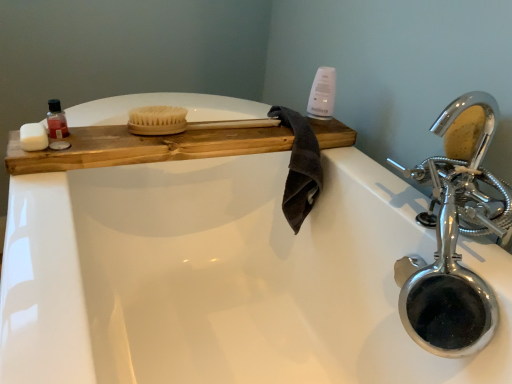
Measure the distance between point [444,274] and camera.

The distance of point [444,274] from camera is 27.36 inches.

What do you see at coordinates (468, 127) in the screenshot? I see `chrome/metallic faucet at right` at bounding box center [468, 127].

This screenshot has width=512, height=384. Describe the element at coordinates (143, 147) in the screenshot. I see `wooden tray at upper left` at that location.

What is the approximate height of wooden tray at upper left?

wooden tray at upper left is 5.44 centimeters tall.

What are the coordinates of `chrome metallic faucet at upper right` in the screenshot? It's located at (455, 235).

How different are the orientations of white matte soap at left and dark brown cotton towel at center in degrees?

2.04 degrees separate the facing orientations of white matte soap at left and dark brown cotton towel at center.

Does white matte soap at left come behind dark brown cotton towel at center?

No, it is not.

Is white matte soap at left facing towards dark brown cotton towel at center?

No, white matte soap at left is not facing towards dark brown cotton towel at center.

Is white matte soap at left spatially inside dark brown cotton towel at center, or outside of it?

white matte soap at left is not inside dark brown cotton towel at center, it's outside.

Can you confirm if dark brown cotton towel at center is positioned to the left of translucent plastic bottle at upper left?

No, dark brown cotton towel at center is not to the left of translucent plastic bottle at upper left.

This screenshot has height=384, width=512. In order to click on mouthwash on the left of dark brown cotton towel at center in this screenshot , I will do `click(56, 120)`.

Is dark brown cotton towel at center not near translucent plastic bottle at upper left?

dark brown cotton towel at center is actually quite close to translucent plastic bottle at upper left.

From the image's perspective, which object appears higher, dark brown cotton towel at center or translucent plastic bottle at upper left?

translucent plastic bottle at upper left is shown above in the image.

Is dark brown cotton towel at center facing away from white glossy bottle at upper right?

No, white glossy bottle at upper right is not at the back of dark brown cotton towel at center.

Is white glossy bottle at upper right completely or partially inside dark brown cotton towel at center?

No, white glossy bottle at upper right is located outside of dark brown cotton towel at center.

Which of these two, dark brown cotton towel at center or white glossy bottle at upper right, stands shorter?

Standing shorter between the two is white glossy bottle at upper right.

From a real-world perspective, is chrome metallic faucet at upper right on top of dark brown cotton towel at center?

Indeed, from a real-world perspective, chrome metallic faucet at upper right stands above dark brown cotton towel at center.

In the image, there is a chrome metallic faucet at upper right. Where is `bath towel below it (from a real-world perspective)`? bath towel below it (from a real-world perspective) is located at coordinates (300, 167).

Choose the correct answer: Is chrome metallic faucet at upper right inside dark brown cotton towel at center or outside it?

chrome metallic faucet at upper right is not inside dark brown cotton towel at center, it's outside.

Between chrome metallic faucet at upper right and dark brown cotton towel at center, which one has smaller size?

dark brown cotton towel at center is smaller.

In the scene shown: Does white glossy bottle at upper right have a greater width compared to chrome metallic faucet at upper right?

In fact, white glossy bottle at upper right might be narrower than chrome metallic faucet at upper right.

Would you consider white glossy bottle at upper right to be distant from chrome metallic faucet at upper right?

No.

Is white glossy bottle at upper right situated inside chrome metallic faucet at upper right or outside?

white glossy bottle at upper right lies outside chrome metallic faucet at upper right.

Which of these two, wooden tray at upper left or translucent plastic bottle at upper left, is bigger?

wooden tray at upper left.

Which object is positioned more to the right, wooden tray at upper left or translucent plastic bottle at upper left?

From the viewer's perspective, wooden tray at upper left appears more on the right side.

Is wooden tray at upper left wider than translucent plastic bottle at upper left?

Indeed, wooden tray at upper left has a greater width compared to translucent plastic bottle at upper left.

Is translucent plastic bottle at upper left at the left side of chrome metallic faucet at upper right?

Indeed, translucent plastic bottle at upper left is positioned on the left side of chrome metallic faucet at upper right.

Between translucent plastic bottle at upper left and chrome metallic faucet at upper right, which one has smaller size?

Smaller between the two is translucent plastic bottle at upper left.

From the image's perspective, is translucent plastic bottle at upper left below chrome metallic faucet at upper right?

No, from the image's perspective, translucent plastic bottle at upper left is not below chrome metallic faucet at upper right.

From a real-world perspective, is translucent plastic bottle at upper left over chrome metallic faucet at upper right?

Yes, from a real-world perspective, translucent plastic bottle at upper left is above chrome metallic faucet at upper right.

Locate an element on the screen. The height and width of the screenshot is (384, 512). soap in front of the dark brown cotton towel at center is located at coordinates (33, 137).

I want to click on bath towel on the right of translucent plastic bottle at upper left, so click(300, 167).

Considering their positions, is dark brown cotton towel at center positioned further to white matte soap at left than translucent plastic bottle at upper left?

dark brown cotton towel at center is further to white matte soap at left.

Estimate the real-world distances between objects in this image. Which object is closer to chrome/metallic faucet at right, natural wood brush at center or translucent plastic bottle at upper left?

natural wood brush at center is positioned closer to the anchor chrome/metallic faucet at right.

When comparing their distances from chrome metallic faucet at upper right, does dark brown cotton towel at center or natural wood brush at center seem closer?

dark brown cotton towel at center is closer to chrome metallic faucet at upper right.

Which object lies further to the anchor point wooden tray at upper left, white matte soap at left or dark brown cotton towel at center?

The object further to wooden tray at upper left is white matte soap at left.

Looking at this image, which object lies nearer to the anchor point natural wood brush at center, wooden tray at upper left or dark brown cotton towel at center?

wooden tray at upper left lies closer to natural wood brush at center than the other object.

Estimate the real-world distances between objects in this image. Which object is closer to chrome metallic faucet at upper right, dark brown cotton towel at center or translucent plastic bottle at upper left?

Based on the image, dark brown cotton towel at center appears to be nearer to chrome metallic faucet at upper right.

When comparing their distances from translucent plastic bottle at upper left, does chrome metallic faucet at upper right or chrome/metallic faucet at right seem closer?

Based on the image, chrome/metallic faucet at right appears to be nearer to translucent plastic bottle at upper left.

Estimate the real-world distances between objects in this image. Which object is further from chrome metallic faucet at upper right, natural wood brush at center or dark brown cotton towel at center?

natural wood brush at center is positioned further to the anchor chrome metallic faucet at upper right.

This screenshot has height=384, width=512. I want to click on brush between wooden tray at upper left and dark brown cotton towel at center in the horizontal direction, so click(x=182, y=121).

Where is `bath towel between white matte soap at left and chrome/metallic faucet at right in the horizontal direction`? This screenshot has width=512, height=384. bath towel between white matte soap at left and chrome/metallic faucet at right in the horizontal direction is located at coordinates (300, 167).

The image size is (512, 384). Find the location of `counter between translucent plastic bottle at upper left and natural wood brush at center from left to right`. counter between translucent plastic bottle at upper left and natural wood brush at center from left to right is located at coordinates (143, 147).

At what (x,y) coordinates should I click in order to perform the action: click on counter situated between translucent plastic bottle at upper left and chrome/metallic faucet at right from left to right. Please return your answer as a coordinate pair (x, y). The image size is (512, 384). Looking at the image, I should click on (143, 147).